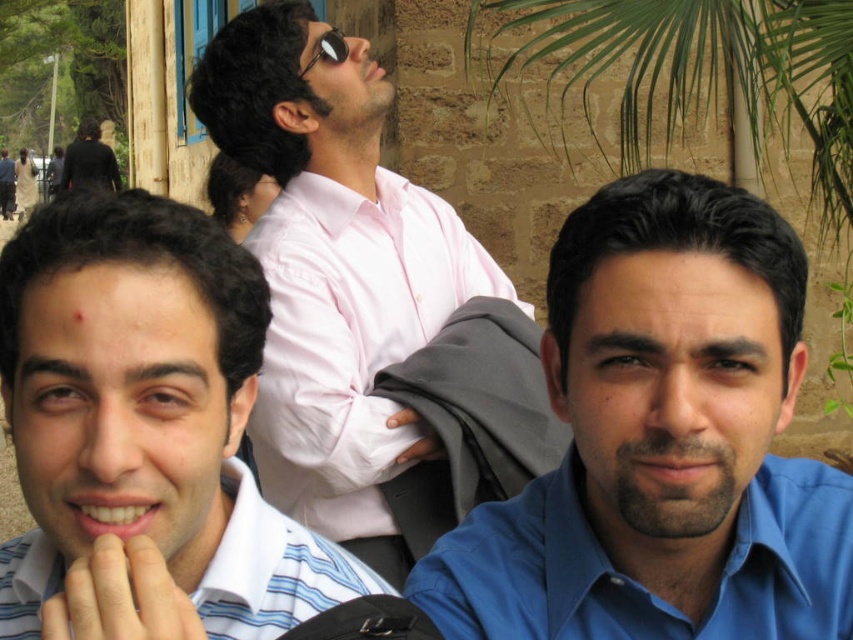
Measure the distance from pink shirt at upper center to black matte jacket at upper left.

pink shirt at upper center is 47.81 meters away from black matte jacket at upper left.

Can you confirm if pink shirt at upper center is positioned to the right of black matte jacket at upper left?

Indeed, pink shirt at upper center is positioned on the right side of black matte jacket at upper left.

Does point (370, 592) come farther from viewer compared to point (76, 179)?

No, (370, 592) is in front of (76, 179).

The image size is (853, 640). Find the location of `pink shirt at upper center`. pink shirt at upper center is located at coordinates click(x=148, y=416).

Which is more to the right, blue smooth shirt at center or black matte jacket at upper left?

blue smooth shirt at center

In the scene shown: Is blue smooth shirt at center bigger than black matte jacket at upper left?

Incorrect, blue smooth shirt at center is not larger than black matte jacket at upper left.

Is point (767, 508) in front of point (80, 157)?

Yes, it is.

What are the coordinates of `blue smooth shirt at center` in the screenshot? It's located at (662, 442).

Which is more to the right, blue smooth shirt at center or pink shirt at center?

blue smooth shirt at center

Which of these two, blue smooth shirt at center or pink shirt at center, stands taller?

With more height is blue smooth shirt at center.

Locate an element on the screen. This screenshot has width=853, height=640. blue smooth shirt at center is located at coordinates coord(662,442).